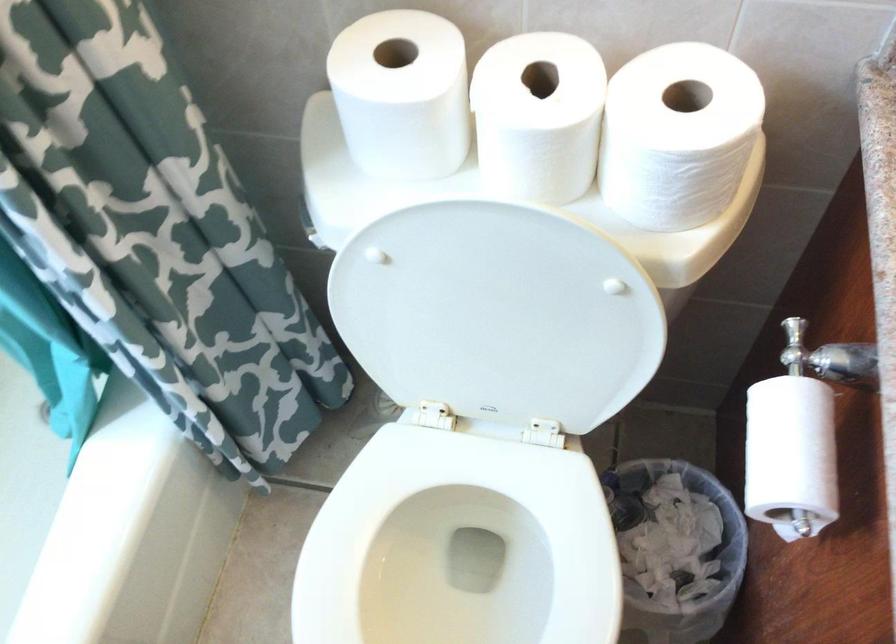
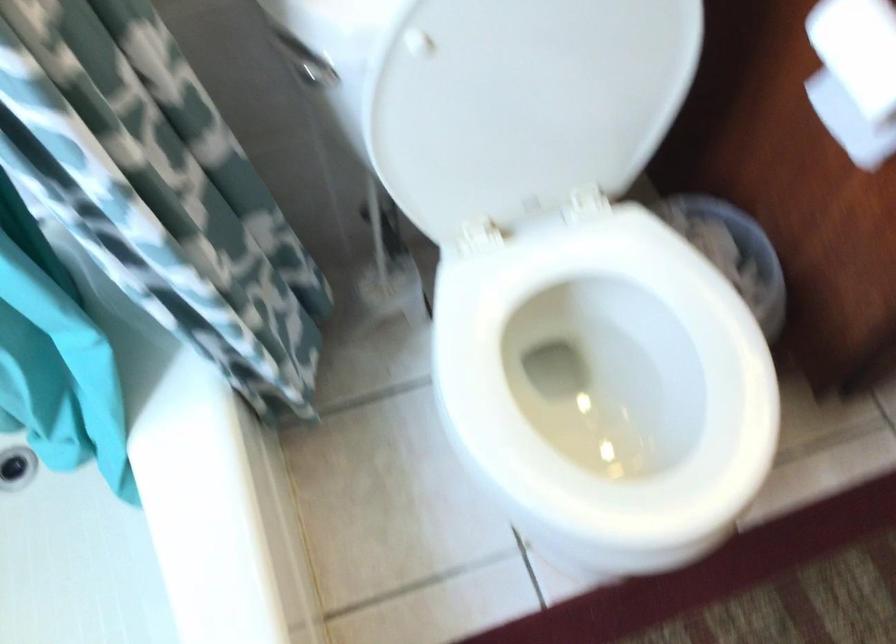
In the second image, find the point that corresponds to point 756,462 in the first image.

(855, 76)